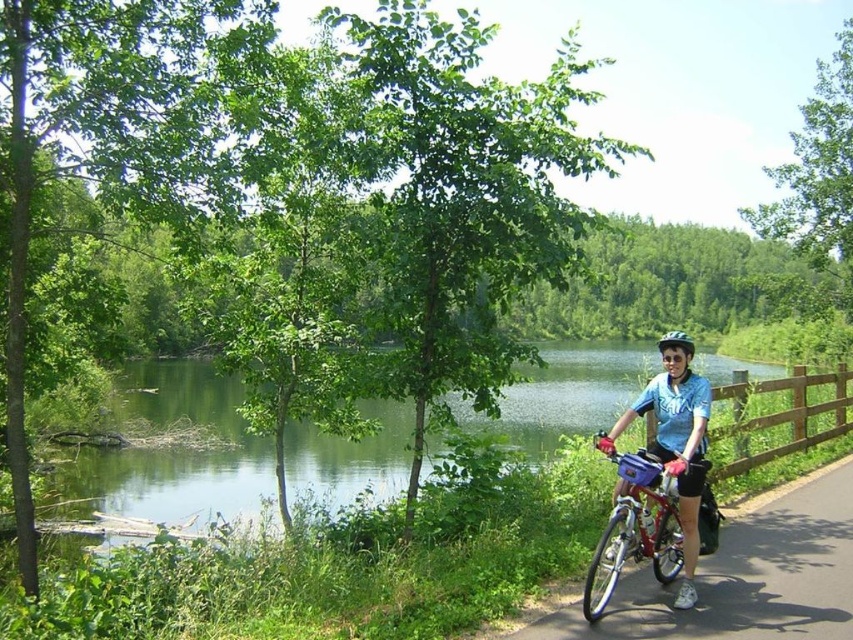
Which of these two, brown wooden fence at right or black matte helmet at upper right, stands shorter?

black matte helmet at upper right is shorter.

Who is more distant from viewer, (798, 412) or (671, 330)?

Point (671, 330)

At what (x,y) coordinates should I click in order to perform the action: click on brown wooden fence at right. Please return your answer as a coordinate pair (x, y). This screenshot has width=853, height=640. Looking at the image, I should click on (795, 416).

Does blue fabric shirt at center lie behind brown wooden fence at right?

No, blue fabric shirt at center is closer to the viewer.

Can you confirm if blue fabric shirt at center is positioned to the right of brown wooden fence at right?

In fact, blue fabric shirt at center is to the left of brown wooden fence at right.

Is point (654, 554) behind point (809, 406)?

No, (654, 554) is in front of (809, 406).

Locate an element on the screen. This screenshot has width=853, height=640. blue fabric shirt at center is located at coordinates [x=659, y=486].

Locate an element on the screen. The height and width of the screenshot is (640, 853). metallic silver bicycle at lower right is located at coordinates (746, 576).

Between metallic silver bicycle at lower right and blue fabric shirt at center, which one has less height?

With less height is metallic silver bicycle at lower right.

What are the coordinates of `metallic silver bicycle at lower right` in the screenshot? It's located at (746, 576).

Locate an element on the screen. metallic silver bicycle at lower right is located at coordinates click(746, 576).